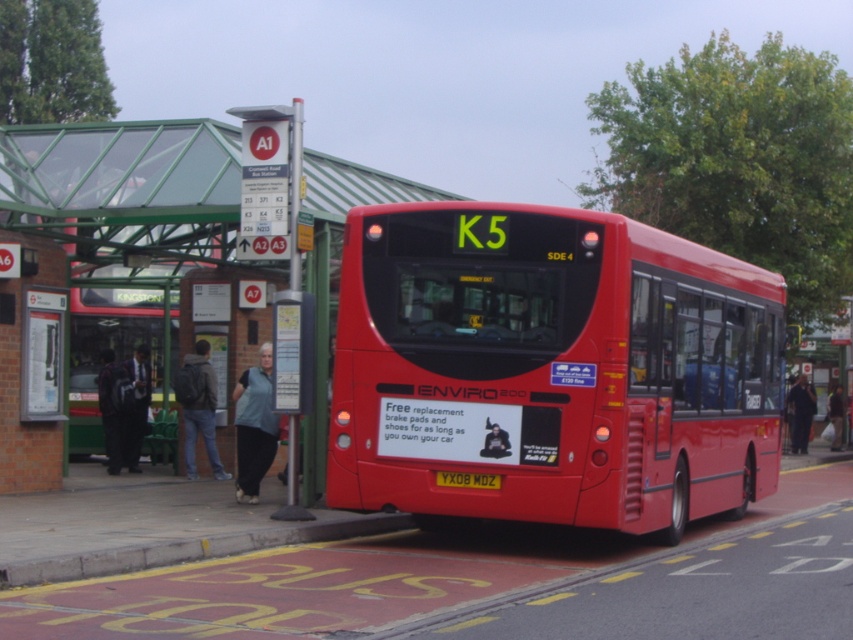
Does yellow painted concrete curb at lower center come in front of denim jacket at lower left?

That is True.

Between yellow painted concrete curb at lower center and denim jacket at lower left, which one is positioned higher?

denim jacket at lower left is higher up.

Is point (373, 525) positioned behind point (175, 390)?

No, it is not.

This screenshot has height=640, width=853. I want to click on yellow painted concrete curb at lower center, so click(x=192, y=548).

Does light blue fabric at center come in front of yellow metallic license plate at rear?

No, light blue fabric at center is further to the viewer.

Does point (260, 442) come farther from viewer compared to point (485, 477)?

Yes, it is behind point (485, 477).

This screenshot has width=853, height=640. I want to click on light blue fabric at center, so click(x=254, y=426).

Who is shorter, yellow painted concrete curb at lower center or yellow metallic license plate at rear?

With less height is yellow metallic license plate at rear.

Is yellow painted concrete curb at lower center wider than yellow metallic license plate at rear?

Yes.

Is point (224, 550) closer to viewer compared to point (457, 483)?

Yes, it is.

You are a GUI agent. You are given a task and a screenshot of the screen. Output one action in this format:
    pyautogui.click(x=<x>, y=<y>)
    Task: Click on the yellow painted concrete curb at lower center
    The width and height of the screenshot is (853, 640).
    Given the screenshot: What is the action you would take?
    pyautogui.click(x=192, y=548)